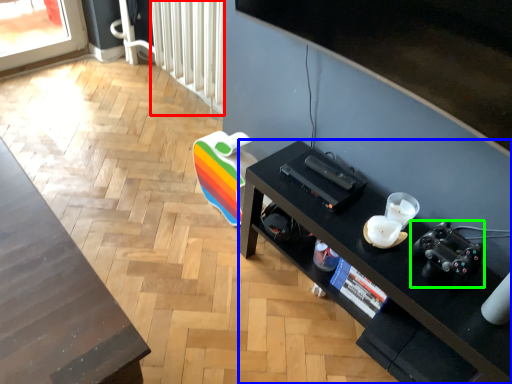
Question: Which is nearer to the radiator (highlighted by a red box)? desk (highlighted by a blue box) or video camera (highlighted by a green box).

Choices:
 (A) desk
 (B) video camera

Answer: (A)